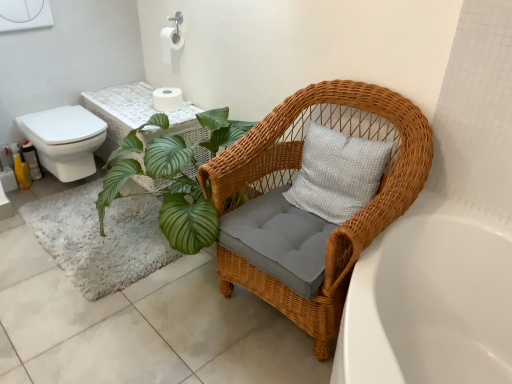
What do you see at coordinates (65, 140) in the screenshot? The width and height of the screenshot is (512, 384). I see `white glossy toilet at left` at bounding box center [65, 140].

I want to click on white matte toilet paper at upper center, which is the 1th toilet paper in top-to-bottom order, so click(x=170, y=42).

Image resolution: width=512 pixels, height=384 pixels. What do you see at coordinates (167, 99) in the screenshot?
I see `white matte toilet paper at upper center, the 1th toilet paper positioned from the bottom` at bounding box center [167, 99].

This screenshot has height=384, width=512. I want to click on woven wicker chair at lower right, so click(294, 178).

Find the location of a particular element. This screenshot has width=512, height=384. white ceramic bathtub at lower right is located at coordinates (430, 301).

Is woven wicker chair at lower right aimed at white matte toilet paper at upper center, which is the second toilet paper in top-to-bottom order?

No, woven wicker chair at lower right is not facing towards white matte toilet paper at upper center, which is the second toilet paper in top-to-bottom order.

Considering the relative positions of woven wicker chair at lower right and white matte toilet paper at upper center, which is the second toilet paper in top-to-bottom order, in the image provided, is woven wicker chair at lower right to the right of white matte toilet paper at upper center, which is the second toilet paper in top-to-bottom order, from the viewer's perspective?

Indeed, woven wicker chair at lower right is positioned on the right side of white matte toilet paper at upper center, which is the second toilet paper in top-to-bottom order.

From a real-world perspective, which object stands above the other?

white matte toilet paper at upper center, which is the second toilet paper in top-to-bottom order, is physically above.

What's the angular difference between woven wicker chair at lower right and white matte toilet paper at upper center, the 1th toilet paper positioned from the bottom,'s facing directions?

1.53 degrees.

From the picture: From the image's perspective, is woven wicker chair at lower right located above or below white ceramic bathtub at lower right?

Based on their image positions, woven wicker chair at lower right is located above white ceramic bathtub at lower right.

From a real-world perspective, is woven wicker chair at lower right located beneath white ceramic bathtub at lower right?

Incorrect, from a real-world perspective, woven wicker chair at lower right is higher than white ceramic bathtub at lower right.

Is woven wicker chair at lower right not close to white ceramic bathtub at lower right?

That's not correct — woven wicker chair at lower right is a little close to white ceramic bathtub at lower right.

Can you confirm if woven wicker chair at lower right is bigger than white ceramic bathtub at lower right?

Yes.

Consider the image. From the image's perspective, which is above, white ceramic bathtub at lower right or woven wicker chair at lower right?

woven wicker chair at lower right appears higher in the image.

Is white ceramic bathtub at lower right wider or thinner than woven wicker chair at lower right?

In the image, white ceramic bathtub at lower right appears to be wider than woven wicker chair at lower right.

Is white ceramic bathtub at lower right bigger or smaller than woven wicker chair at lower right?

Clearly, white ceramic bathtub at lower right is smaller in size than woven wicker chair at lower right.

Is white matte toilet paper at upper center, which is the second toilet paper in top-to-bottom order, wider or thinner than white matte toilet paper at upper center, which is the 1th toilet paper in top-to-bottom order?

Clearly, white matte toilet paper at upper center, which is the second toilet paper in top-to-bottom order, has more width compared to white matte toilet paper at upper center, which is the 1th toilet paper in top-to-bottom order.

From the image's perspective, which is below, white matte toilet paper at upper center, the 1th toilet paper positioned from the bottom, or white matte toilet paper at upper center, which is the 1th toilet paper in top-to-bottom order?

white matte toilet paper at upper center, the 1th toilet paper positioned from the bottom, is shown below in the image.

I want to click on toilet paper on the left of the white matte toilet paper at upper center, which is the 1th toilet paper in top-to-bottom order, so click(167, 99).

You are a GUI agent. You are given a task and a screenshot of the screen. Output one action in this format:
    pyautogui.click(x=<x>, y=<y>)
    Task: Click on the toilet below the white matte toilet paper at upper center, which is the second toilet paper in top-to-bottom order (from a real-world perspective)
    This screenshot has width=512, height=384.
    Given the screenshot: What is the action you would take?
    pyautogui.click(x=65, y=140)

Which is more to the right, white matte toilet paper at upper center, which is the second toilet paper in top-to-bottom order, or white glossy toilet at left?

white matte toilet paper at upper center, which is the second toilet paper in top-to-bottom order, is more to the right.

Are white matte toilet paper at upper center, which is the second toilet paper in top-to-bottom order, and white glossy toilet at left located far from each other?

No, white matte toilet paper at upper center, which is the second toilet paper in top-to-bottom order, is not far from white glossy toilet at left.

Who is taller, white matte toilet paper at upper center, which is the 1th toilet paper in top-to-bottom order, or white ceramic bathtub at lower right?

white ceramic bathtub at lower right.

Can white ceramic bathtub at lower right be found inside white matte toilet paper at upper center, positioned as the 2th toilet paper in bottom-to-top order?

Actually, white ceramic bathtub at lower right is outside white matte toilet paper at upper center, positioned as the 2th toilet paper in bottom-to-top order.

Between white matte toilet paper at upper center, which is the 1th toilet paper in top-to-bottom order, and white ceramic bathtub at lower right, which one appears on the left side from the viewer's perspective?

→ Positioned to the left is white matte toilet paper at upper center, which is the 1th toilet paper in top-to-bottom order.

Is white matte toilet paper at upper center, which is the 1th toilet paper in top-to-bottom order, bigger or smaller than white ceramic bathtub at lower right?

In the image, white matte toilet paper at upper center, which is the 1th toilet paper in top-to-bottom order, appears to be smaller than white ceramic bathtub at lower right.

I want to click on chair below the white glossy toilet at left (from the image's perspective), so click(294, 178).

Considering the relative sizes of white glossy toilet at left and woven wicker chair at lower right in the image provided, is white glossy toilet at left smaller than woven wicker chair at lower right?

Indeed, white glossy toilet at left has a smaller size compared to woven wicker chair at lower right.

Can you confirm if white glossy toilet at left is thinner than woven wicker chair at lower right?

Correct, the width of white glossy toilet at left is less than that of woven wicker chair at lower right.

From the image's perspective, would you say white glossy toilet at left is positioned over woven wicker chair at lower right?

Yes, from the image's perspective, white glossy toilet at left is over woven wicker chair at lower right.

There is a woven wicker chair at lower right. Find the location of `the 1st toilet paper above it (from the image's perspective)`. the 1st toilet paper above it (from the image's perspective) is located at coordinates (167, 99).

Find the location of a particular element. chair on the left of white ceramic bathtub at lower right is located at coordinates (294, 178).

When comparing their distances from woven wicker chair at lower right, does white matte toilet paper at upper center, positioned as the 2th toilet paper in bottom-to-top order, or white glossy toilet at left seem closer?

white glossy toilet at left is closer to woven wicker chair at lower right.

Considering their positions, is white ceramic bathtub at lower right positioned further to white matte toilet paper at upper center, the 1th toilet paper positioned from the bottom, than woven wicker chair at lower right?

The object further to white matte toilet paper at upper center, the 1th toilet paper positioned from the bottom, is white ceramic bathtub at lower right.

When comparing their distances from white ceramic bathtub at lower right, does woven wicker chair at lower right or white glossy toilet at left seem closer?

woven wicker chair at lower right is positioned closer to the anchor white ceramic bathtub at lower right.

Estimate the real-world distances between objects in this image. Which object is closer to woven wicker chair at lower right, white glossy toilet at left or white matte toilet paper at upper center, which is the 1th toilet paper in top-to-bottom order?

white glossy toilet at left lies closer to woven wicker chair at lower right than the other object.

When comparing their distances from white ceramic bathtub at lower right, does white matte toilet paper at upper center, which is the 1th toilet paper in top-to-bottom order, or woven wicker chair at lower right seem closer?

Among the two, woven wicker chair at lower right is located nearer to white ceramic bathtub at lower right.

Which object lies further to the anchor point white matte toilet paper at upper center, which is the second toilet paper in top-to-bottom order, woven wicker chair at lower right or white ceramic bathtub at lower right?

white ceramic bathtub at lower right lies further to white matte toilet paper at upper center, which is the second toilet paper in top-to-bottom order, than the other object.

Looking at the image, which one is located further to woven wicker chair at lower right, white ceramic bathtub at lower right or white matte toilet paper at upper center, positioned as the 2th toilet paper in bottom-to-top order?

Among the two, white matte toilet paper at upper center, positioned as the 2th toilet paper in bottom-to-top order, is located further to woven wicker chair at lower right.

Estimate the real-world distances between objects in this image. Which object is further from white ceramic bathtub at lower right, white matte toilet paper at upper center, which is the second toilet paper in top-to-bottom order, or white matte toilet paper at upper center, positioned as the 2th toilet paper in bottom-to-top order?

Among the two, white matte toilet paper at upper center, positioned as the 2th toilet paper in bottom-to-top order, is located further to white ceramic bathtub at lower right.

The height and width of the screenshot is (384, 512). Find the location of `toilet paper between white glossy toilet at left and white matte toilet paper at upper center, positioned as the 2th toilet paper in bottom-to-top order, from left to right`. toilet paper between white glossy toilet at left and white matte toilet paper at upper center, positioned as the 2th toilet paper in bottom-to-top order, from left to right is located at coordinates (167, 99).

Where is `chair positioned between white ceramic bathtub at lower right and white matte toilet paper at upper center, positioned as the 2th toilet paper in bottom-to-top order, from near to far`? The height and width of the screenshot is (384, 512). chair positioned between white ceramic bathtub at lower right and white matte toilet paper at upper center, positioned as the 2th toilet paper in bottom-to-top order, from near to far is located at coordinates (294, 178).

Identify the location of toilet between woven wicker chair at lower right and white matte toilet paper at upper center, the 1th toilet paper positioned from the bottom, along the z-axis. The image size is (512, 384). (65, 140).

Where is `toilet between white ceramic bathtub at lower right and white matte toilet paper at upper center, which is the 1th toilet paper in top-to-bottom order, along the z-axis`? Image resolution: width=512 pixels, height=384 pixels. toilet between white ceramic bathtub at lower right and white matte toilet paper at upper center, which is the 1th toilet paper in top-to-bottom order, along the z-axis is located at coordinates (65, 140).